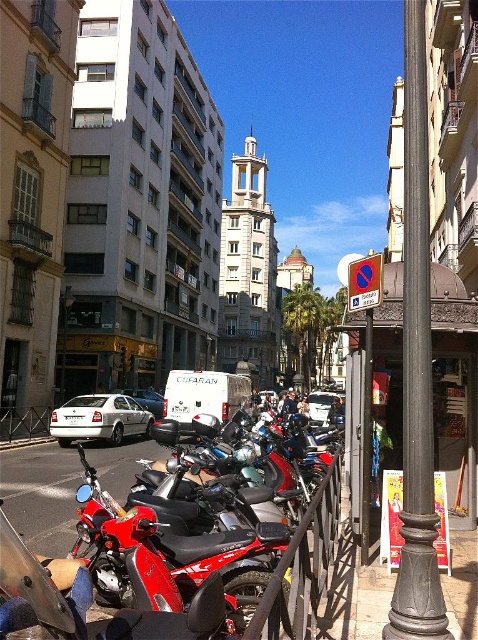
You are a delivery driver who needs to park your white matte van at center. The parking spot is at point [319,406]. Is the van already occupying the parking spot?

Yes, the white matte van at center is already occupying the parking spot at point [319,406].